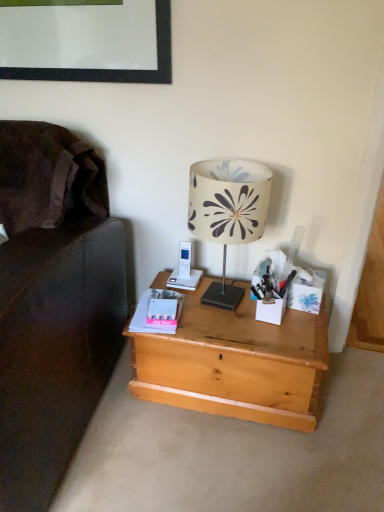
Question: Is matte pink paperback book at center-left wider or thinner than white matte box at right?

Choices:
 (A) thin
 (B) wide

Answer: (B)

Question: Based on their sizes in the image, would you say matte pink paperback book at center-left is bigger or smaller than white matte box at right?

Choices:
 (A) small
 (B) big

Answer: (A)

Question: Based on their relative distances, which object is nearer to the natural wood desk at center?

Choices:
 (A) white matte box at right
 (B) white matte stationery at right
 (C) matte pink paperback book at center-left
 (D) white fabric lampshade at center

Answer: (B)

Question: Estimate the real-world distances between objects in this image. Which object is farther from the natural wood desk at center?

Choices:
 (A) white matte stationery at right
 (B) matte pink paperback book at center-left
 (C) white matte box at right
 (D) white fabric lampshade at center

Answer: (D)